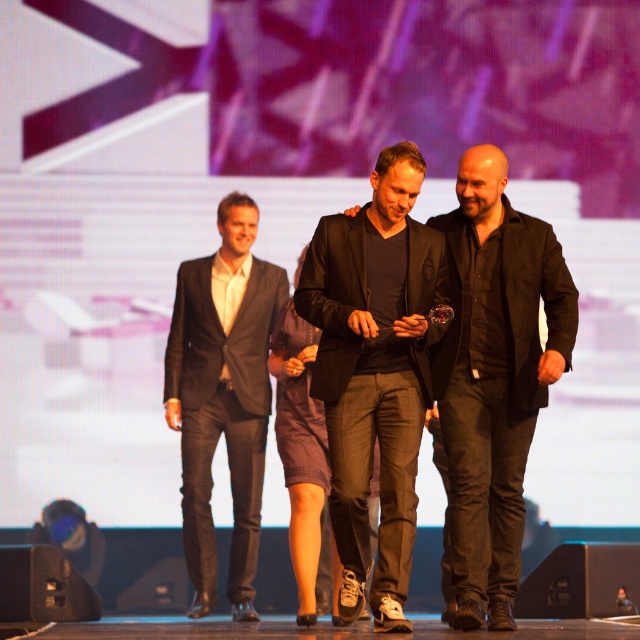
You are a photographer at the event and need to adjust the camera focus. Which of the two subjects, the black matte suit at center or the dark gray suit at left, should you focus on first if you want to capture the tallest person?

The dark gray suit at left is taller than the black matte suit at center, so you should focus on the dark gray suit at left first.

You are a photographer at the awards ceremony. You need to capture a photo where both the black matte suit at center and the black matte jacket at center are visible. Since the two items are at the same position, will the taller one block the shorter one from view?

The black matte suit at center is taller than the black matte jacket at center, so it may block the view of the shorter one if they are positioned directly in front.